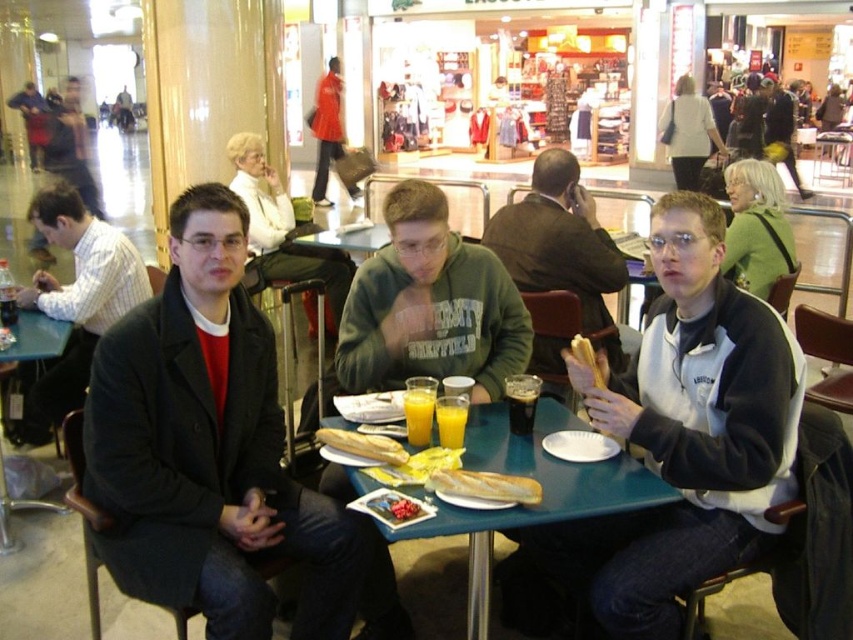
Can you confirm if dark gray wool coat at center is shorter than green cotton hoodie at center?

Incorrect, dark gray wool coat at center's height does not fall short of green cotton hoodie at center's.

Does dark gray wool coat at center appear on the left side of green cotton hoodie at center?

Indeed, dark gray wool coat at center is positioned on the left side of green cotton hoodie at center.

At what (x,y) coordinates should I click in order to perform the action: click on dark gray wool coat at center. Please return your answer as a coordinate pair (x, y). Looking at the image, I should click on pyautogui.click(x=212, y=451).

This screenshot has height=640, width=853. What are the coordinates of `dark gray wool coat at center` in the screenshot? It's located at (212, 451).

Does green plastic table at center appear under red jacket at center?

Yes, green plastic table at center is below red jacket at center.

Is green plastic table at center taller than red jacket at center?

No, green plastic table at center is not taller than red jacket at center.

Where is `green plastic table at center`? The width and height of the screenshot is (853, 640). green plastic table at center is located at coordinates (543, 490).

Which of these two, matte black jacket at left or golden crusty baguette at table center, stands taller?

Standing taller between the two is matte black jacket at left.

Who is higher up, matte black jacket at left or golden crusty baguette at table center?

Positioned higher is matte black jacket at left.

The height and width of the screenshot is (640, 853). What do you see at coordinates (74, 300) in the screenshot? I see `matte black jacket at left` at bounding box center [74, 300].

The width and height of the screenshot is (853, 640). What are the coordinates of `matte black jacket at left` in the screenshot? It's located at (74, 300).